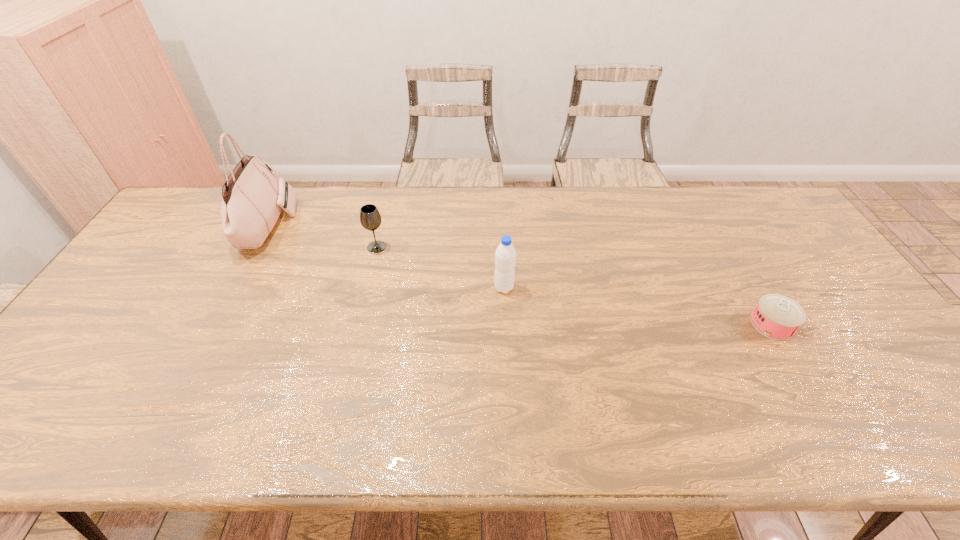
Find the location of `vacant space that's between the handbag and the nearest object`. vacant space that's between the handbag and the nearest object is located at coordinates (519, 275).

The image size is (960, 540). In order to click on free spot between the second tallest object and the shortest object in this screenshot , I will do `click(637, 306)`.

Locate an element on the screen. free point between the shortest object and the second object from left to right is located at coordinates 574,286.

The height and width of the screenshot is (540, 960). Identify the location of empty space between the second object from left to right and the second tallest object. (441, 267).

You are a GUI agent. You are given a task and a screenshot of the screen. Output one action in this format:
    pyautogui.click(x=<x>, y=<y>)
    Task: Click on the vacant area that lies between the rightmost object and the second object from left to right
    The height and width of the screenshot is (540, 960).
    Given the screenshot: What is the action you would take?
    pyautogui.click(x=574, y=286)

Locate an element on the screen. This screenshot has height=540, width=960. free point between the third farthest object and the wineglass is located at coordinates (441, 267).

Locate an element on the screen. This screenshot has height=540, width=960. blank region between the second object from left to right and the third shortest object is located at coordinates (441, 267).

Image resolution: width=960 pixels, height=540 pixels. Find the location of `object that is the closest to the tallest object`. object that is the closest to the tallest object is located at coordinates (370, 218).

Locate which object ranks second in proximity to the rightmost object. Please provide its 2D coordinates. Your answer should be formatted as a tuple, i.e. [(x, y)], where the tuple contains the x and y coordinates of a point satisfying the conditions above.

[(370, 218)]

I want to click on free location that satisfies the following two spatial constraints: 1. on the front side of the second nearest object; 2. on the right side of the can, so click(x=506, y=324).